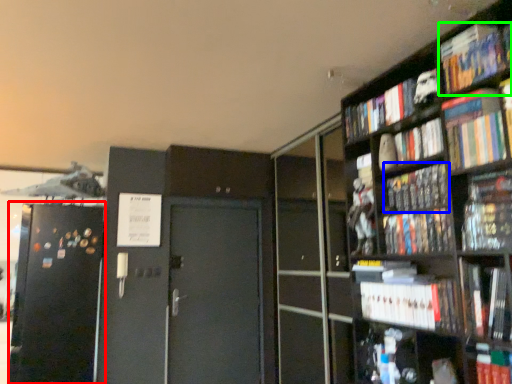
Question: Which object is the farthest from fridge (highlighted by a red box)? Choose among these: book (highlighted by a blue box) or book (highlighted by a green box).

Choices:
 (A) book
 (B) book

Answer: (B)